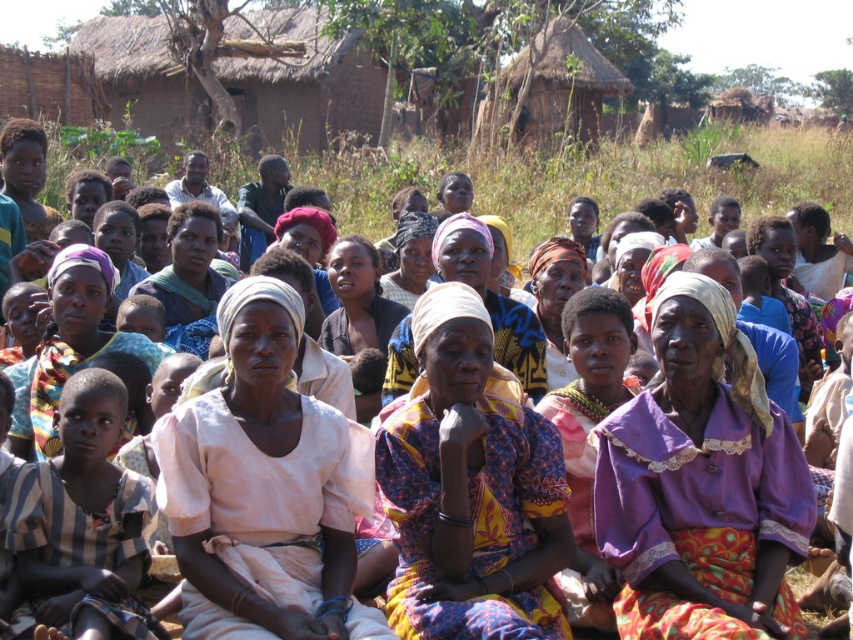
Question: Does purple fabric at center have a lesser width compared to printed fabric dress at center?

Choices:
 (A) yes
 (B) no

Answer: (B)

Question: Which of the following is the closest to the observer?

Choices:
 (A) (502, 531)
 (B) (740, 609)
 (C) (318, 600)
 (D) (144, 344)

Answer: (B)

Question: Does purple fabric at center come behind purple fabric headscarf at center?

Choices:
 (A) yes
 (B) no

Answer: (B)

Question: Which point is closer to the camera?

Choices:
 (A) (265, 408)
 (B) (722, 289)

Answer: (A)

Question: Based on their relative distances, which object is farther from the printed fabric dress at center?

Choices:
 (A) purple fabric at center
 (B) multicolored fabric headscarf at center

Answer: (B)

Question: Can you confirm if pink fabric at center is wider than purple fabric headscarf at center?

Choices:
 (A) yes
 (B) no

Answer: (A)